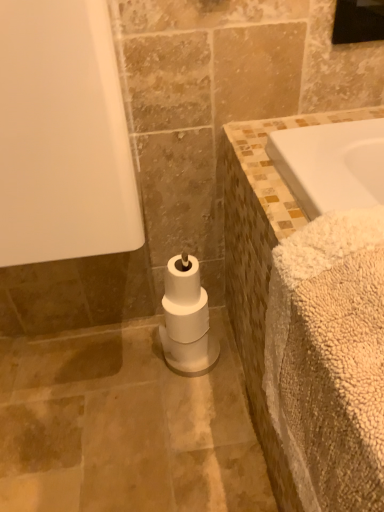
The width and height of the screenshot is (384, 512). Find the location of `white matte toilet paper at center`. white matte toilet paper at center is located at coordinates (186, 319).

The height and width of the screenshot is (512, 384). What do you see at coordinates (296, 287) in the screenshot?
I see `beige fluffy bath towel at right` at bounding box center [296, 287].

What are the coordinates of `black glass mirror at upper right` in the screenshot? It's located at (358, 21).

Between beige fluffy bath towel at right and white matte toilet paper at center, which one has larger size?

Bigger between the two is beige fluffy bath towel at right.

Which is behind, point (274, 402) or point (166, 308)?

The point (166, 308) is more distant.

Can you confirm if beige fluffy bath towel at right is taller than white matte toilet paper at center?

Indeed, beige fluffy bath towel at right has a greater height compared to white matte toilet paper at center.

Are beige fluffy bath towel at right and white matte toilet paper at center beside each other?

No, beige fluffy bath towel at right is not beside white matte toilet paper at center.

Is beige fluffy bath towel at right turned away from black glass mirror at upper right?

No, beige fluffy bath towel at right is not facing away from black glass mirror at upper right.

Can you confirm if beige fluffy bath towel at right is taller than black glass mirror at upper right?

Indeed, beige fluffy bath towel at right has a greater height compared to black glass mirror at upper right.

From the picture: Is beige fluffy bath towel at right not close to black glass mirror at upper right?

No, there isn't a large distance between beige fluffy bath towel at right and black glass mirror at upper right.

Does black glass mirror at upper right have a greater height compared to beige fluffy bath towel at right?

Incorrect, the height of black glass mirror at upper right is not larger of that of beige fluffy bath towel at right.

Is black glass mirror at upper right not within beige fluffy bath towel at right?

Yes.

Is black glass mirror at upper right oriented towards beige fluffy bath towel at right?

No, black glass mirror at upper right does not turn towards beige fluffy bath towel at right.

How many degrees apart are the facing directions of white matte toilet paper at center and beige fluffy bath towel at right?

The facing directions of white matte toilet paper at center and beige fluffy bath towel at right are 92.1 degrees apart.

In the scene shown: Is white matte toilet paper at center further to the viewer compared to beige fluffy bath towel at right?

That is True.

Looking at this image, from the image's perspective, is white matte toilet paper at center under beige fluffy bath towel at right?

No.

From a real-world perspective, who is located lower, white matte toilet paper at center or beige fluffy bath towel at right?

From a 3D spatial view, white matte toilet paper at center is below.

Is white matte toilet paper at center touching black glass mirror at upper right?

There is a gap between white matte toilet paper at center and black glass mirror at upper right.

Does white matte toilet paper at center have a larger size compared to black glass mirror at upper right?

Yes.

Consider the image. Which object is thinner, white matte toilet paper at center or black glass mirror at upper right?

With smaller width is black glass mirror at upper right.

From a real-world perspective, is black glass mirror at upper right on white matte toilet paper at center?

Yes, from a real-world perspective, black glass mirror at upper right is on top of white matte toilet paper at center.

Does black glass mirror at upper right have a lesser width compared to white matte toilet paper at center?

Yes, black glass mirror at upper right is thinner than white matte toilet paper at center.

Between black glass mirror at upper right and white matte toilet paper at center, which one has smaller size?

With smaller size is black glass mirror at upper right.

Between point (333, 30) and point (185, 289), which one is positioned in front?

Point (333, 30)

Image resolution: width=384 pixels, height=512 pixels. I want to click on bath towel above the white matte toilet paper at center (from a real-world perspective), so click(296, 287).

Where is `bath towel lying below the black glass mirror at upper right (from the image's perspective)`? The height and width of the screenshot is (512, 384). bath towel lying below the black glass mirror at upper right (from the image's perspective) is located at coordinates (296, 287).

Consider the image. Looking at the image, which one is located closer to white matte toilet paper at center, black glass mirror at upper right or beige fluffy bath towel at right?

The object closer to white matte toilet paper at center is beige fluffy bath towel at right.

Looking at the image, which one is located further to black glass mirror at upper right, white matte toilet paper at center or beige fluffy bath towel at right?

The object further to black glass mirror at upper right is white matte toilet paper at center.

Based on their spatial positions, is black glass mirror at upper right or white matte toilet paper at center closer to beige fluffy bath towel at right?

Based on the image, white matte toilet paper at center appears to be nearer to beige fluffy bath towel at right.

Based on the photo, from the image, which object appears to be farther from black glass mirror at upper right, beige fluffy bath towel at right or white matte toilet paper at center?

The object further to black glass mirror at upper right is white matte toilet paper at center.

Looking at the image, which one is located further to beige fluffy bath towel at right, white matte toilet paper at center or black glass mirror at upper right?

Based on the image, black glass mirror at upper right appears to be further to beige fluffy bath towel at right.

Estimate the real-world distances between objects in this image. Which object is closer to white matte toilet paper at center, beige fluffy bath towel at right or black glass mirror at upper right?

The object closer to white matte toilet paper at center is beige fluffy bath towel at right.

I want to click on toilet paper between black glass mirror at upper right and beige fluffy bath towel at right in the vertical direction, so click(186, 319).